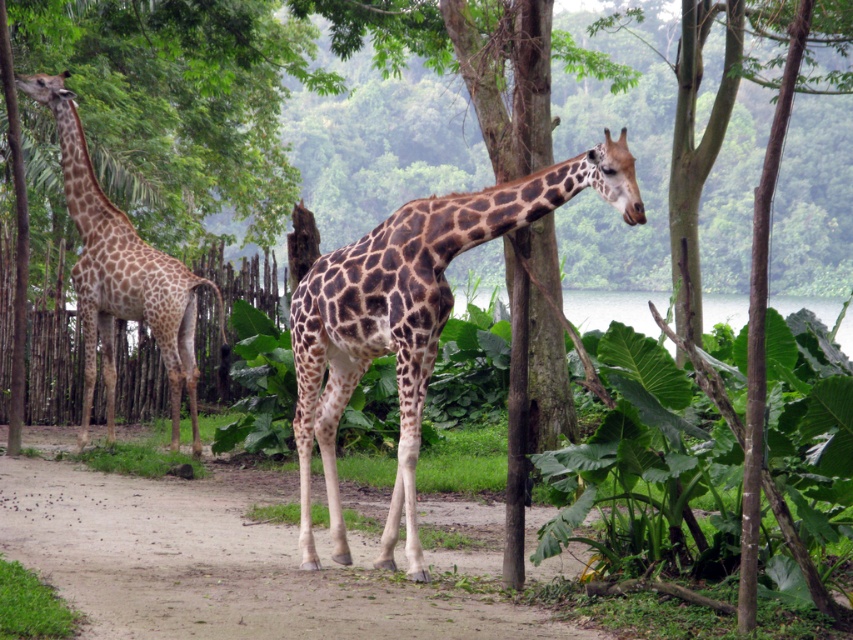
You are a zookeeper planning to walk along the dusty sand path at lower center to feed the spotted fur giraffe at center. Can you approach the giraffe directly from the path without needing to detour around any obstacles?

The dusty sand path at lower center is in front of the spotted fur giraffe at center, so you can approach the giraffe directly from the path without needing to detour around any obstacles.

You are a zookeeper standing at the entrance of the giraffe enclosure. You need to locate the spotted fur giraffe at center. Based on the coordinates provided, where should you look to find it?

The spotted fur giraffe at center is located at coordinates point (410, 317), which is near the center of the enclosure.

You are a zookeeper planning to walk along the dusty sand path at lower center while observing the spotted fur giraffe at left. Can you estimate whether the path is narrow enough to allow you to walk safely without stepping off the path?

The dusty sand path at lower center is narrower than the spotted fur giraffe at left, so it might be too narrow for safe walking. Consider taking a wider path or adjusting your route to ensure safety.